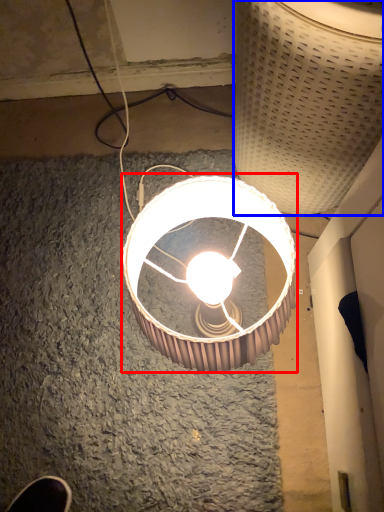
Question: Which object appears closest to the camera in this image, lamp (highlighted by a red box) or lamp (highlighted by a blue box)?

Choices:
 (A) lamp
 (B) lamp

Answer: (B)